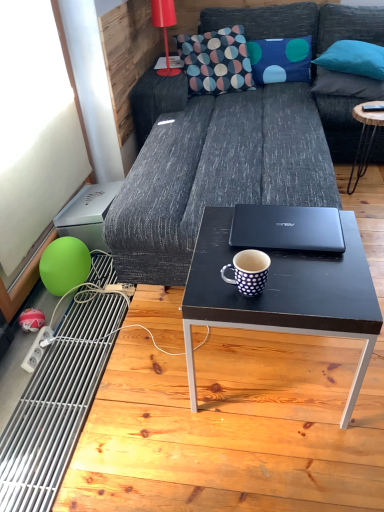
Question: Is black wood coffee table at right, arranged as the second coffee table when viewed from the front, not within patterned fabric pillow at upper center?

Choices:
 (A) no
 (B) yes

Answer: (B)

Question: From the image's perspective, does black wood coffee table at right, positioned as the 2th coffee table in left-to-right order, appear higher than patterned fabric pillow at upper center?

Choices:
 (A) no
 (B) yes

Answer: (A)

Question: Are black wood coffee table at right, which appears as the first coffee table when viewed from the right, and patterned fabric pillow at upper center located far from each other?

Choices:
 (A) yes
 (B) no

Answer: (B)

Question: Can you confirm if black wood coffee table at right, which is the 1th coffee table in top-to-bottom order, is bigger than patterned fabric pillow at upper center?

Choices:
 (A) yes
 (B) no

Answer: (B)

Question: Does black wood coffee table at right, acting as the 2th coffee table starting from the bottom, come behind patterned fabric pillow at upper center?

Choices:
 (A) no
 (B) yes

Answer: (A)

Question: Is black wood coffee table at right, positioned as the 2th coffee table in left-to-right order, positioned in front of patterned fabric pillow at upper center?

Choices:
 (A) no
 (B) yes

Answer: (B)

Question: Is blue dotted fabric pillow at upper center, marked as the third pillow in a right-to-left arrangement, turned away from black wood coffee table at right, which appears as the first coffee table when viewed from the right?

Choices:
 (A) yes
 (B) no

Answer: (B)

Question: Is black wood coffee table at right, which appears as the first coffee table when viewed from the right, a part of blue dotted fabric pillow at upper center, the first pillow when ordered from left to right?

Choices:
 (A) no
 (B) yes

Answer: (A)

Question: Is blue dotted fabric pillow at upper center, the first pillow when ordered from left to right, positioned before black wood coffee table at right, which is the 1th coffee table in top-to-bottom order?

Choices:
 (A) yes
 (B) no

Answer: (B)

Question: Is blue dotted fabric pillow at upper center, the first pillow when ordered from left to right, placed right next to black wood coffee table at right, which is the 1th coffee table in top-to-bottom order?

Choices:
 (A) yes
 (B) no

Answer: (B)

Question: Is blue dotted fabric pillow at upper center, the first pillow when ordered from left to right, far away from black wood coffee table at right, which is counted as the first coffee table, starting from the back?

Choices:
 (A) no
 (B) yes

Answer: (A)

Question: Considering the relative sizes of blue dotted fabric pillow at upper center, the first pillow when ordered from left to right, and black wood coffee table at right, arranged as the second coffee table when viewed from the front, in the image provided, is blue dotted fabric pillow at upper center, the first pillow when ordered from left to right, smaller than black wood coffee table at right, arranged as the second coffee table when viewed from the front,?

Choices:
 (A) yes
 (B) no

Answer: (A)

Question: Can you confirm if dark gray fabric couch at center is wider than matte red lamp at upper left?

Choices:
 (A) no
 (B) yes

Answer: (B)